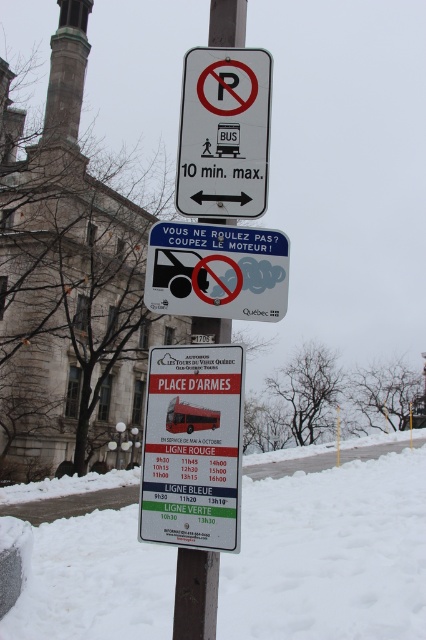
You are a delivery person trying to park your van near the white powdery snow at lower center and the white paper sign at center. Which object takes up more space in the image?

The white powdery snow at lower center is larger in size than the white paper sign at center, so it takes up more space in the image.

You are a city planner reviewing the signs on the pole in the snowy urban scene. You notice two signs labeled as white plastic bus at center and white paper bus at center. Which of these signs is positioned higher up on the pole?

The white plastic bus at center is positioned higher up on the pole because it is taller than the white paper bus at center.

You are a pedestrian trying to read the white paper sign at center while standing on the white powdery snow at lower center. Which direction should you move to face the sign properly?

The white powdery snow at lower center is on the right side of the white paper sign at center, so you should move to your left to face the sign properly.